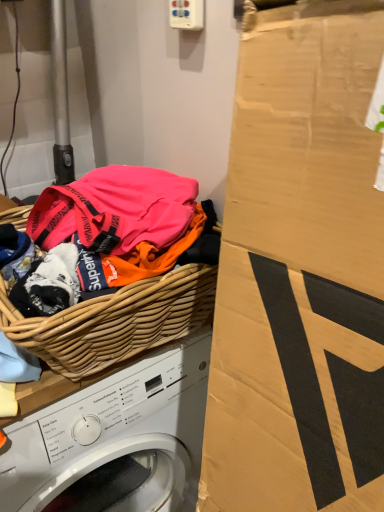
Question: Do you think woven wood basket at left is within white woven basket at upper left, or outside of it?

Choices:
 (A) inside
 (B) outside

Answer: (B)

Question: From a real-world perspective, is woven wood basket at left above or below white woven basket at upper left?

Choices:
 (A) below
 (B) above

Answer: (B)

Question: From the image's perspective, is woven wood basket at left located above or below white woven basket at upper left?

Choices:
 (A) above
 (B) below

Answer: (A)

Question: Looking at the image, does white woven basket at upper left seem bigger or smaller compared to woven wood basket at left?

Choices:
 (A) big
 (B) small

Answer: (A)

Question: Looking at their shapes, would you say white woven basket at upper left is wider or thinner than woven wood basket at left?

Choices:
 (A) thin
 (B) wide

Answer: (B)

Question: Choose the correct answer: Is white woven basket at upper left inside woven wood basket at left or outside it?

Choices:
 (A) inside
 (B) outside

Answer: (B)

Question: From their relative heights in the image, would you say white woven basket at upper left is taller or shorter than woven wood basket at left?

Choices:
 (A) short
 (B) tall

Answer: (B)